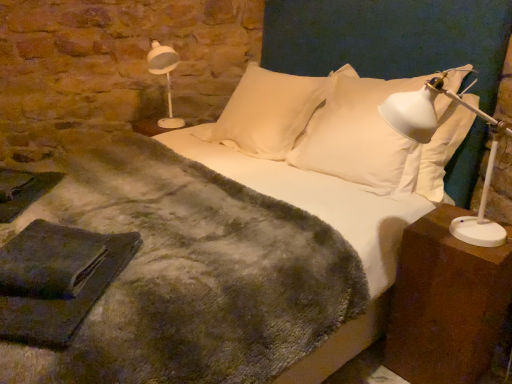
Question: Does brown wooden nightstand at right have a lesser height compared to white plastic lamp at upper left?

Choices:
 (A) no
 (B) yes

Answer: (A)

Question: Considering the relative sizes of brown wooden nightstand at right and white plastic lamp at upper left in the image provided, is brown wooden nightstand at right bigger than white plastic lamp at upper left?

Choices:
 (A) no
 (B) yes

Answer: (B)

Question: Is the position of brown wooden nightstand at right less distant than that of white plastic lamp at upper left?

Choices:
 (A) no
 (B) yes

Answer: (B)

Question: Are brown wooden nightstand at right and white plastic lamp at upper left located far from each other?

Choices:
 (A) yes
 (B) no

Answer: (A)

Question: Can you confirm if brown wooden nightstand at right is positioned to the left of white plastic lamp at upper left?

Choices:
 (A) yes
 (B) no

Answer: (B)

Question: From the image's perspective, is brown wooden nightstand at right on top of white plastic lamp at upper left?

Choices:
 (A) yes
 (B) no

Answer: (B)

Question: Are white soft pillow at upper center, which is the 1th pillow in right-to-left order, and brown wooden nightstand at right making contact?

Choices:
 (A) yes
 (B) no

Answer: (B)

Question: Is brown wooden nightstand at right located within white soft pillow at upper center, marked as the 2th pillow in a left-to-right arrangement?

Choices:
 (A) no
 (B) yes

Answer: (A)

Question: Does white soft pillow at upper center, which is the 1th pillow in right-to-left order, have a smaller size compared to brown wooden nightstand at right?

Choices:
 (A) yes
 (B) no

Answer: (B)

Question: Can you confirm if white soft pillow at upper center, marked as the 2th pillow in a left-to-right arrangement, is shorter than brown wooden nightstand at right?

Choices:
 (A) no
 (B) yes

Answer: (A)

Question: Can you confirm if white soft pillow at upper center, marked as the 2th pillow in a left-to-right arrangement, is bigger than brown wooden nightstand at right?

Choices:
 (A) yes
 (B) no

Answer: (A)

Question: From a real-world perspective, is white soft pillow at center, the first pillow from the left, physically below white plastic table lamp at right?

Choices:
 (A) no
 (B) yes

Answer: (B)